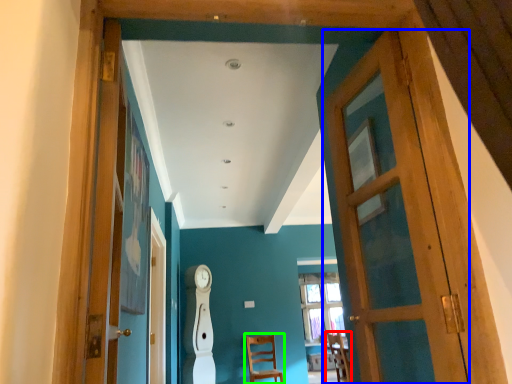
Question: Considering the real-world distances, which object is closest to chair (highlighted by a red box)? door (highlighted by a blue box) or chair (highlighted by a green box).

Choices:
 (A) door
 (B) chair

Answer: (B)